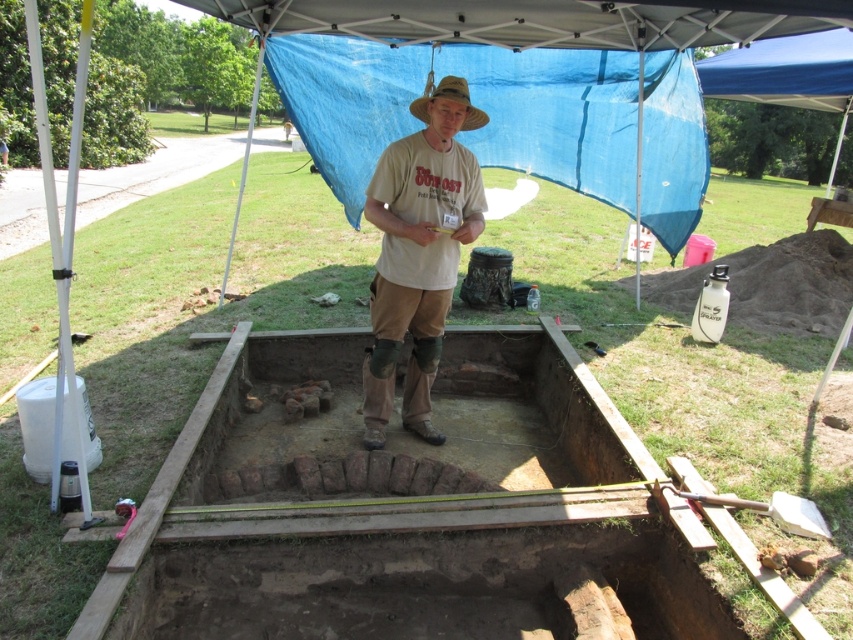
Between brown clay foundation at center and brown straw hat at center, which one is positioned higher?

brown straw hat at center is higher up.

Is point (317, 426) farther from camera compared to point (482, 120)?

Yes.

Is point (201, 428) positioned before point (450, 77)?

Yes, point (201, 428) is in front of point (450, 77).

Where is `brown clay foundation at center`? brown clay foundation at center is located at coordinates (405, 509).

Which is in front, point (444, 218) or point (462, 125)?

Point (444, 218) is in front.

Can you confirm if beige cotton shirt at center is positioned to the left of brown straw hat at center?

Correct, you'll find beige cotton shirt at center to the left of brown straw hat at center.

Who is more forward, [460,106] or [422,99]?

Point [460,106] is in front.

This screenshot has height=640, width=853. What are the coordinates of `beige cotton shirt at center` in the screenshot? It's located at (418, 252).

Between brown clay foundation at center and beige cotton shirt at center, which one has less height?

brown clay foundation at center is shorter.

How distant is brown clay foundation at center from beige cotton shirt at center?

The distance of brown clay foundation at center from beige cotton shirt at center is 37.30 inches.

What do you see at coordinates (405, 509) in the screenshot?
I see `brown clay foundation at center` at bounding box center [405, 509].

Identify the location of brown clay foundation at center. The width and height of the screenshot is (853, 640). (405, 509).